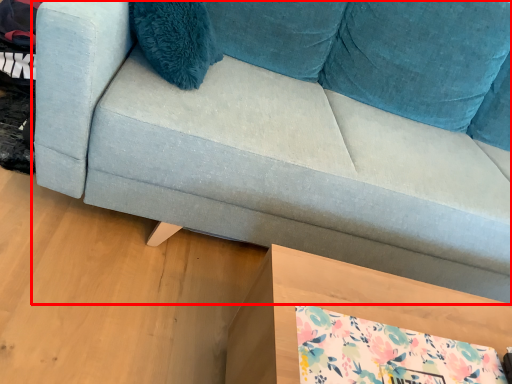
Question: From the image's perspective, considering the relative positions of studio couch (annotated by the red box) and table in the image provided, where is studio couch (annotated by the red box) located with respect to the staircase?

Choices:
 (A) above
 (B) below

Answer: (A)